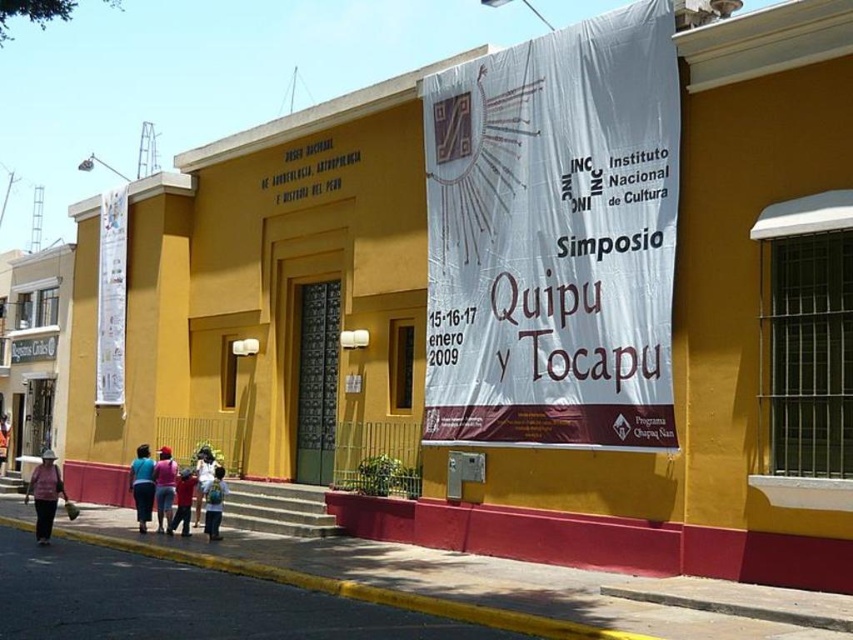
Question: Which of the following is the farthest from the observer?

Choices:
 (A) red cotton shirt at lower left
 (B) matte pink bag at lower left
 (C) white cotton shirt at center
 (D) white paper banner at upper center

Answer: (C)

Question: Observing the image, what is the correct spatial positioning of blue fabric shirt at lower left in reference to red cotton shirt at lower left?

Choices:
 (A) above
 (B) below

Answer: (A)

Question: Is white paper banner at upper center above red cotton shirt at lower left?

Choices:
 (A) no
 (B) yes

Answer: (B)

Question: Can you confirm if matte pink shirt at lower center is bigger than red cotton shirt at lower left?

Choices:
 (A) yes
 (B) no

Answer: (B)

Question: Which object appears closest to the camera in this image?

Choices:
 (A) blue fabric shirt at lower left
 (B) white paper banner at upper center
 (C) matte pink shirt at lower center

Answer: (B)

Question: Which is nearer to the blue fabric shirt at lower left?

Choices:
 (A) matte pink bag at lower left
 (B) blue denim jeans at lower center
 (C) matte pink shirt at lower center
 (D) white paper banner at upper center

Answer: (C)